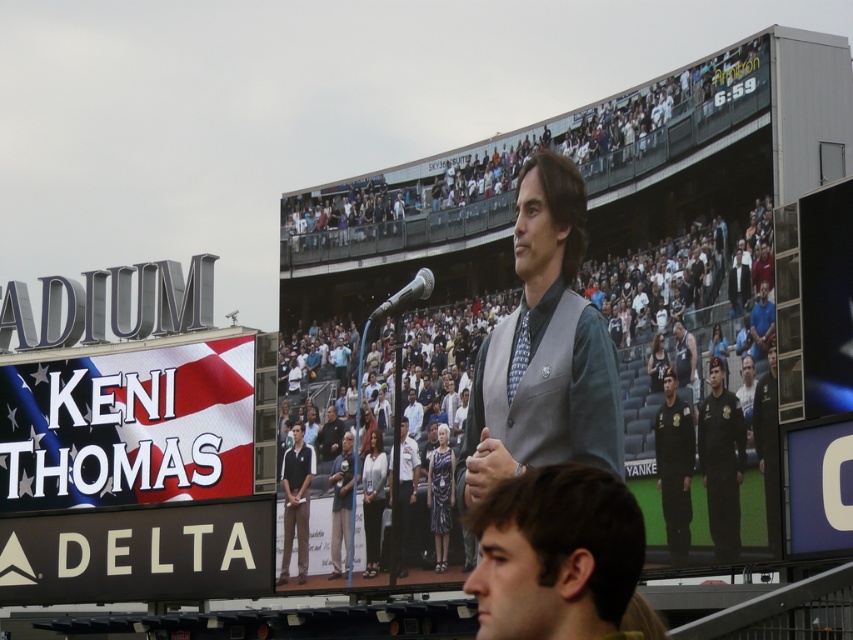
You are a photographer at the stadium and need to capture a clear shot of the gray fabric vest at center without the white fabric sign at left obstructing it. How should you adjust your camera position?

Move your camera position forward so that the gray fabric vest at center comes into view in front of the white fabric sign at left. Since the gray fabric vest at center is currently behind the white fabric sign at left, moving closer will reduce the likelihood of the sign blocking the vest.

You are standing at the center of the stadium and see the point at coordinates point (x=126, y=428). What object is located at that point?

The point (x=126, y=428) corresponds to the white fabric sign at left.

You are a spectator at the stadium event and want to locate the white fabric sign at left. Where should you look in the image?

You should look at point (126, 428) in the image to find the white fabric sign at left.